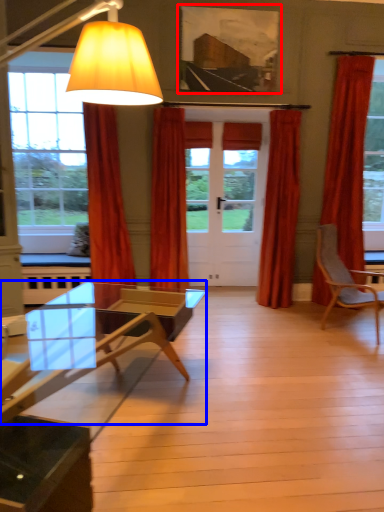
Question: Which object appears farthest to the camera in this image, picture frame (highlighted by a red box) or coffee table (highlighted by a blue box)?

Choices:
 (A) picture frame
 (B) coffee table

Answer: (A)